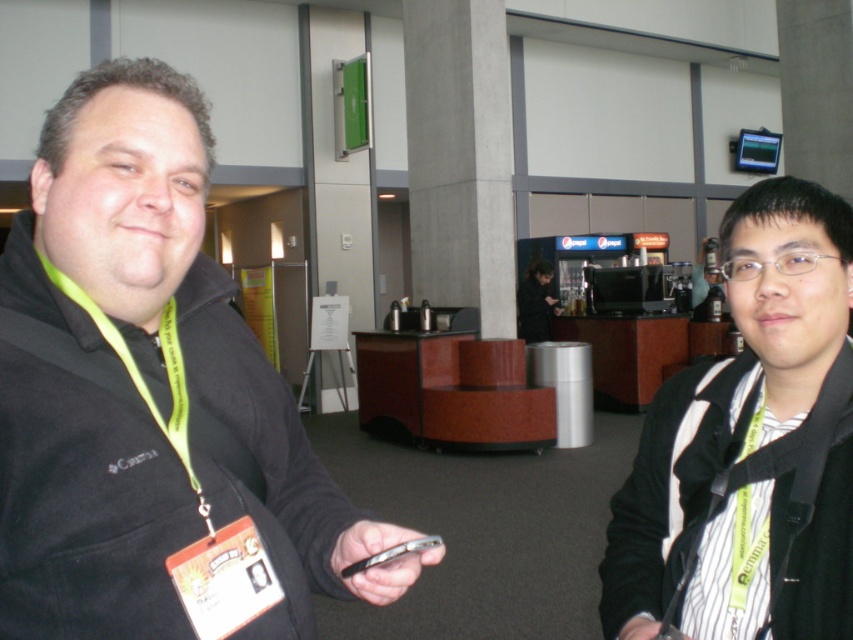
Does black fleece jacket at center appear on the left side of black matte jacket at center?

Yes, black fleece jacket at center is to the left of black matte jacket at center.

Can you confirm if black fleece jacket at center is shorter than black matte jacket at center?

In fact, black fleece jacket at center may be taller than black matte jacket at center.

Where is `black fleece jacket at center`? black fleece jacket at center is located at coordinates (152, 401).

How far apart are black fleece jacket at center and green fabric lanyard at left?

black fleece jacket at center and green fabric lanyard at left are 10.01 centimeters apart.

Is black fleece jacket at center to the left of green fabric lanyard at left from the viewer's perspective?

No, black fleece jacket at center is not to the left of green fabric lanyard at left.

Locate an element on the screen. This screenshot has height=640, width=853. black fleece jacket at center is located at coordinates pyautogui.click(x=152, y=401).

The image size is (853, 640). What do you see at coordinates (750, 448) in the screenshot?
I see `black matte jacket at center` at bounding box center [750, 448].

Is black matte jacket at center smaller than green fabric lanyard at left?

No, black matte jacket at center is not smaller than green fabric lanyard at left.

What are the coordinates of `black matte jacket at center` in the screenshot? It's located at (750, 448).

The width and height of the screenshot is (853, 640). In order to click on black matte jacket at center in this screenshot , I will do `click(750, 448)`.